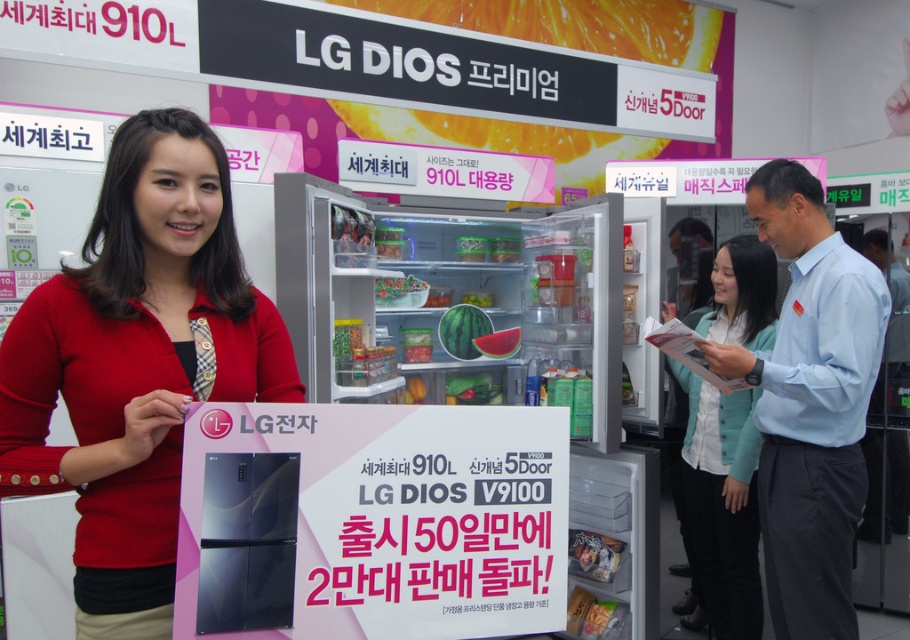
Question: Can you confirm if matte black refrigerator at left is bigger than translucent plastic container at center?

Choices:
 (A) no
 (B) yes

Answer: (B)

Question: Which object is positioned closest to the translucent plastic container at center?

Choices:
 (A) matte black refrigerator at left
 (B) light blue fabric jacket at center

Answer: (B)

Question: Is matte black refrigerator at left positioned behind light blue shirt at upper right?

Choices:
 (A) no
 (B) yes

Answer: (A)

Question: Can you confirm if matte black refrigerator at left is positioned above light blue fabric jacket at center?

Choices:
 (A) yes
 (B) no

Answer: (A)

Question: Estimate the real-world distances between objects in this image. Which object is closer to the light blue shirt at upper right?

Choices:
 (A) light blue fabric jacket at center
 (B) matte black refrigerator at left

Answer: (A)

Question: Which point is farther to the camera?

Choices:
 (A) light blue shirt at upper right
 (B) matte black refrigerator at left
 (C) translucent plastic container at center
 (D) light blue fabric jacket at center

Answer: (C)